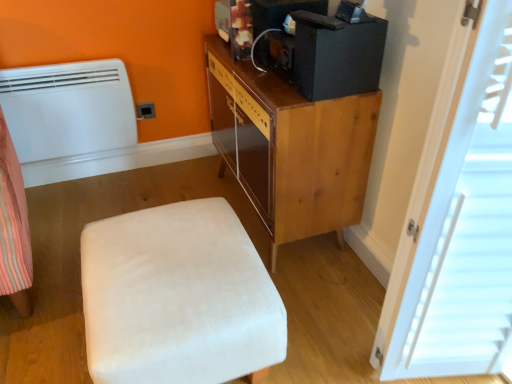
Where is `unoccupied area behind white wood door at right`? The height and width of the screenshot is (384, 512). unoccupied area behind white wood door at right is located at coordinates (355, 287).